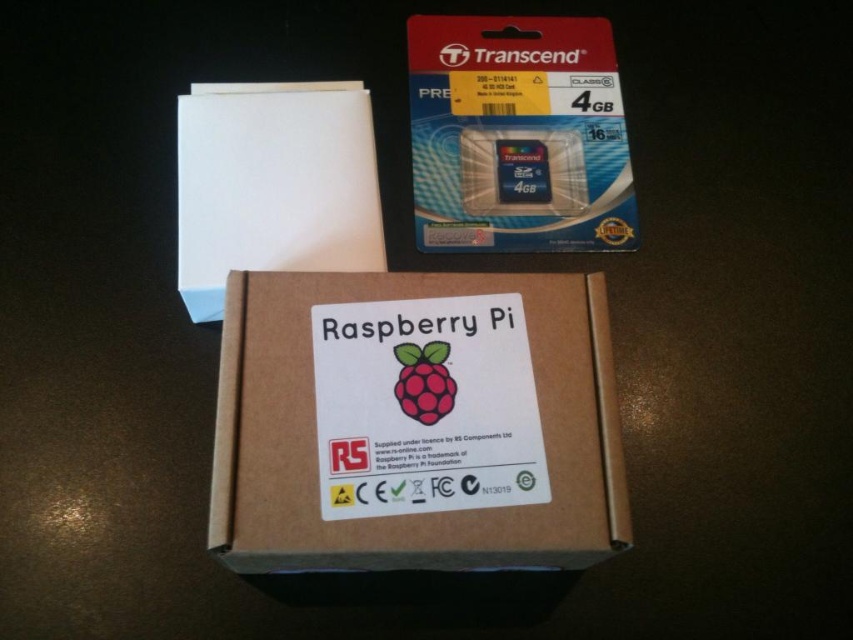
You are organizing a tech workshop and need to place the translucent plastic sd card at upper right and the matte plastic raspberry at center into a storage container. The container has a width of 18 inches. Can both items fit side by side horizontally without overlapping?

The distance between the translucent plastic sd card at upper right and the matte plastic raspberry at center is 17.73 inches. Since the container is 18 inches wide, there is enough space for both items to fit side by side without overlapping.

You are organizing items on a desk and need to place a new item between the brown cardboard box at center and the translucent plastic sd card at upper right. Based on their positions, where should you place the new item relative to the existing objects?

The brown cardboard box at center is in front of the translucent plastic sd card at upper right, so you should place the new item between them along the depth axis, behind the box but in front of the SD card.